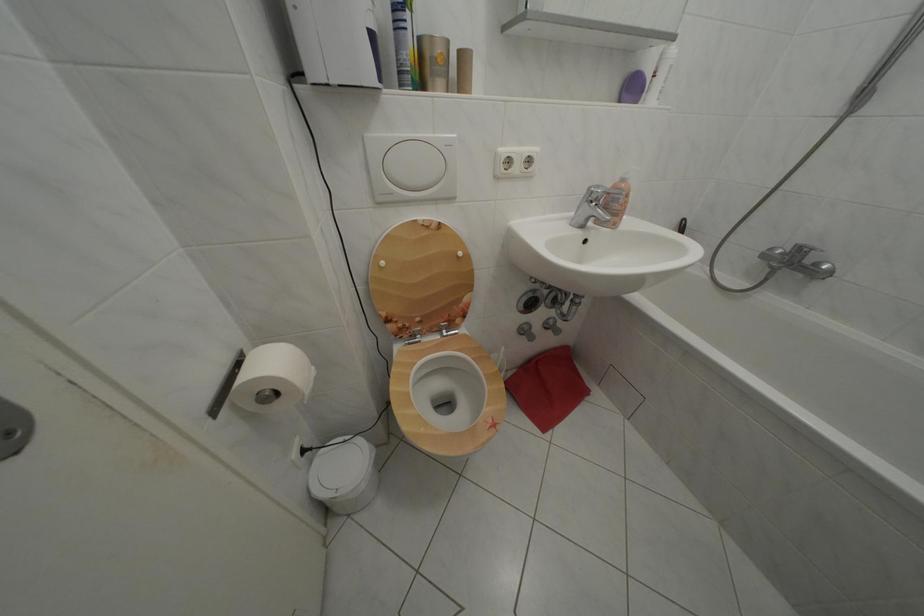
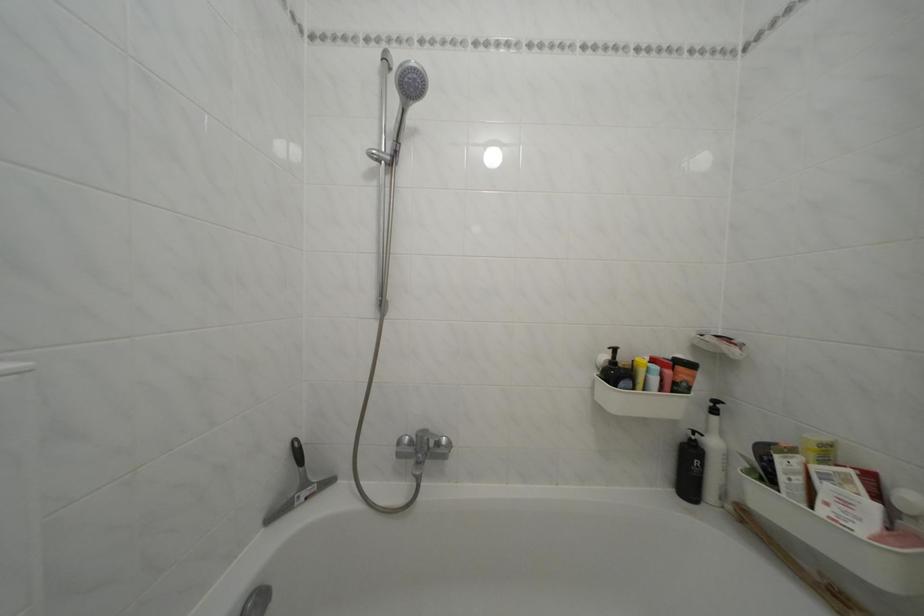
Question: Based on the continuous images, in which direction is the camera rotating? Reply with the corresponding letter.

Choices:
 (A) Left
 (B) Right
 (C) Up
 (D) Down

Answer: (B)